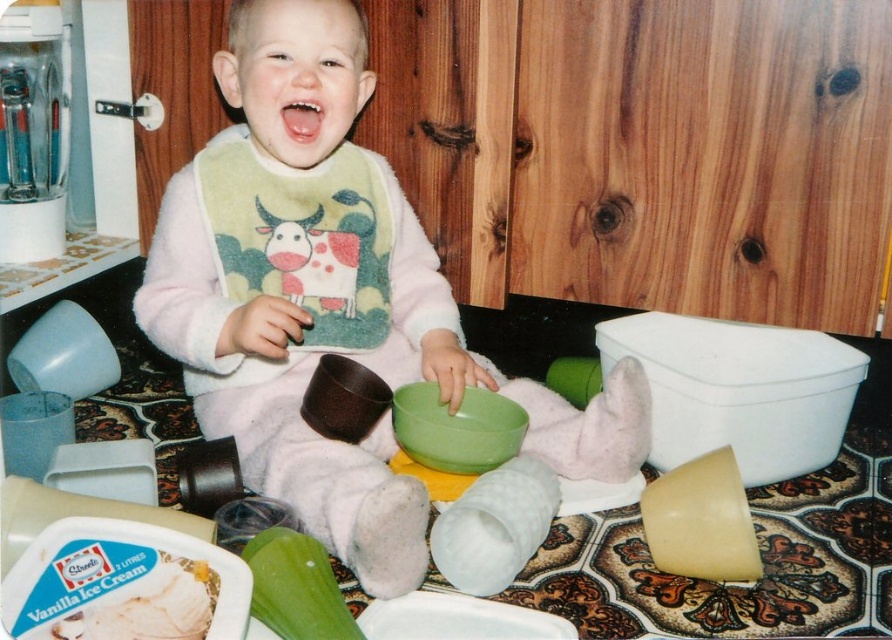
Question: Is pink fleece bib at center positioned behind pink matte mouth at center?

Choices:
 (A) yes
 (B) no

Answer: (B)

Question: Where is pink fleece bib at center located in relation to pink matte mouth at center in the image?

Choices:
 (A) left
 (B) right

Answer: (B)

Question: Which of the following is the closest to the observer?

Choices:
 (A) (293, 99)
 (B) (158, 227)

Answer: (A)

Question: Does pink fleece bib at center appear on the left side of pink matte mouth at center?

Choices:
 (A) no
 (B) yes

Answer: (A)

Question: Which object appears farthest from the camera in this image?

Choices:
 (A) pink fleece bib at center
 (B) pink matte mouth at center

Answer: (B)

Question: Which object is closer to the camera taking this photo?

Choices:
 (A) pink fleece bib at center
 (B) pink matte mouth at center

Answer: (A)